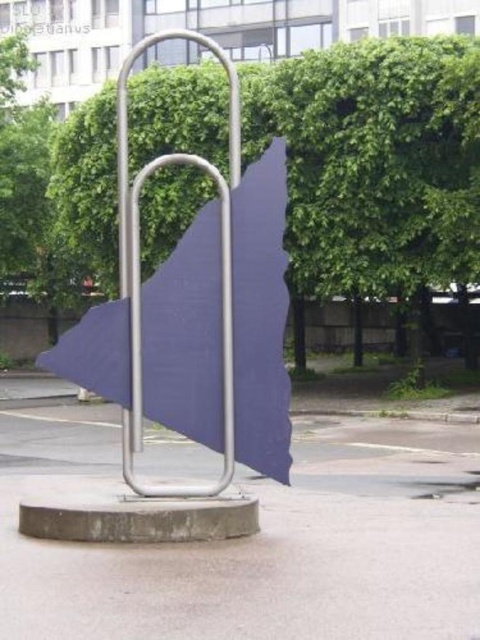
You are standing in front of the sculpture and notice a point marked at coordinates (374, 163). What does this point indicate?

The point at coordinates (374, 163) indicates the location of the green leafy tree at center.

You are standing in a park and see a green leafy tree at center and a satin silver pole at center. Which object is shorter?

The green leafy tree at center is shorter than the satin silver pole at center.

You are an artist planning to place a new sculpture in a public plaza. You have two objects from the scene, the satin silver paperclip at center and the satin silver pole at center. If you want to create a composition where one object is significantly taller than the other, which object should you choose as the taller one?

The satin silver pole at center should be the taller one since the satin silver paperclip at center is not as tall as it.